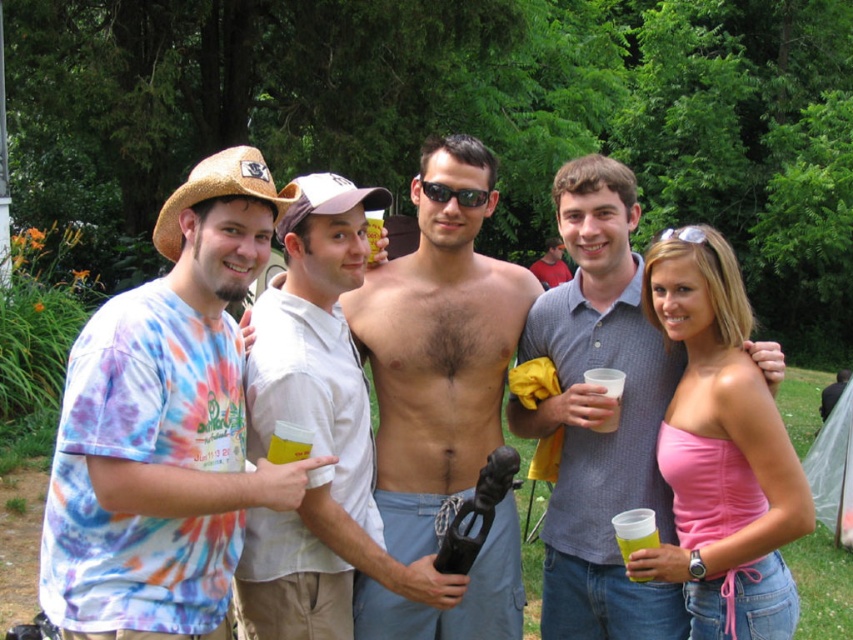
How distant is strawhat at left from brown straw cowboy hat at upper left?

strawhat at left and brown straw cowboy hat at upper left are 14.55 inches apart.

Who is shorter, strawhat at left or brown straw cowboy hat at upper left?

brown straw cowboy hat at upper left is shorter.

Which is in front, point (231, 189) or point (374, 202)?

Point (231, 189) is more forward.

This screenshot has height=640, width=853. Find the location of `strawhat at left`. strawhat at left is located at coordinates (219, 193).

Who is more forward, (260, 168) or (451, 193)?

Point (260, 168)

Can you confirm if strawhat at left is positioned to the right of sunglasses at center?

No, strawhat at left is not to the right of sunglasses at center.

Between point (189, 204) and point (467, 188), which one is positioned behind?

The point (467, 188) is more distant.

The height and width of the screenshot is (640, 853). Identify the location of strawhat at left. (219, 193).

Is point (724, 310) positioned in front of point (173, 252)?

No, (724, 310) is further to viewer.

Who is higher up, pink satin tank top at center or strawhat at left?

Positioned higher is strawhat at left.

What do you see at coordinates (721, 451) in the screenshot? I see `pink satin tank top at center` at bounding box center [721, 451].

You are a GUI agent. You are given a task and a screenshot of the screen. Output one action in this format:
    pyautogui.click(x=<x>, y=<y>)
    Task: Click on the pink satin tank top at center
    The height and width of the screenshot is (640, 853).
    Given the screenshot: What is the action you would take?
    pyautogui.click(x=721, y=451)